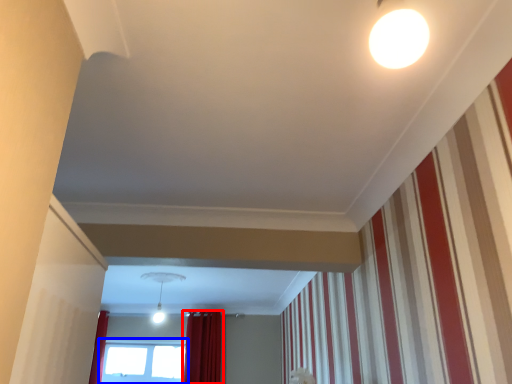
Question: Among these objects, which one is nearest to the camera, curtain (highlighted by a red box) or window (highlighted by a blue box)?

Choices:
 (A) curtain
 (B) window

Answer: (A)